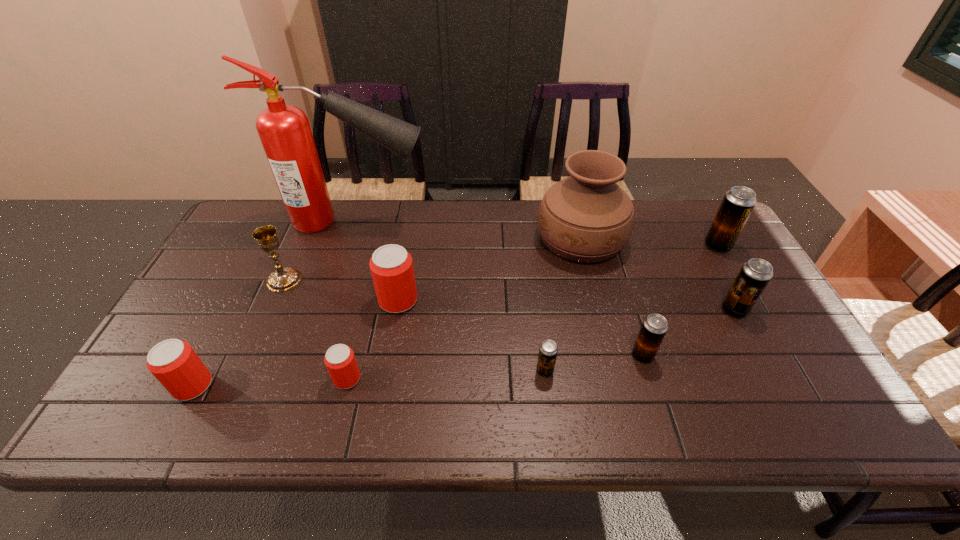
Find the location of `free space between the biggest red beer can and the third nearest black beer can`. free space between the biggest red beer can and the third nearest black beer can is located at coordinates (566, 305).

Where is `unoccupied position between the third smallest black beer can and the second smallest black beer can`? unoccupied position between the third smallest black beer can and the second smallest black beer can is located at coordinates point(688,333).

The height and width of the screenshot is (540, 960). In order to click on free space between the smallest black beer can and the leftmost red beer can in this screenshot , I will do `click(369, 378)`.

You are a GUI agent. You are given a task and a screenshot of the screen. Output one action in this format:
    pyautogui.click(x=<x>, y=<y>)
    Task: Click on the vacant space that's between the third black beer can from right to left and the second red beer can from right to left
    
    Given the screenshot: What is the action you would take?
    pyautogui.click(x=494, y=367)

I want to click on free point between the smallest red beer can and the urn, so click(x=464, y=309).

The width and height of the screenshot is (960, 540). I want to click on vacant space that's between the fourth beer can from right to left and the second red beer can from right to left, so pos(446,375).

You are a GUI agent. You are given a task and a screenshot of the screen. Output one action in this format:
    pyautogui.click(x=<x>, y=<y>)
    Task: Click on the free area in between the farthest beer can and the smallest black beer can
    The height and width of the screenshot is (540, 960).
    Given the screenshot: What is the action you would take?
    pos(632,308)

At what (x,y) coordinates should I click in order to perform the action: click on blank region between the chalice and the fifth beer can from right to left. Please return your answer as a coordinate pair (x, y). Looking at the image, I should click on (341, 290).

Locate which object is the third closest to the tallest beer can. Please provide its 2D coordinates. Your answer should be formatted as a tuple, i.e. [(x, y)], where the tuple contains the x and y coordinates of a point satisfying the conditions above.

[(654, 327)]

Where is `the fifth closest object to the ninth shortest object`? Image resolution: width=960 pixels, height=540 pixels. the fifth closest object to the ninth shortest object is located at coordinates (284, 130).